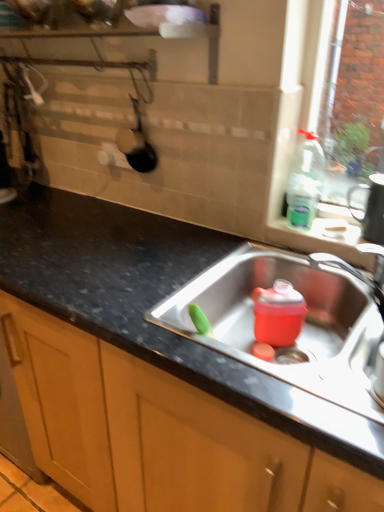
Question: Considering the positions of stainless steel sink at center and black matte mug at upper right in the image, is stainless steel sink at center wider or thinner than black matte mug at upper right?

Choices:
 (A) thin
 (B) wide

Answer: (B)

Question: Is stainless steel sink at center inside or outside of black matte mug at upper right?

Choices:
 (A) inside
 (B) outside

Answer: (B)

Question: Estimate the real-world distances between objects in this image. Which object is farther from the black granite countertop at center?

Choices:
 (A) metallic silver tap at right
 (B) stainless steel sink at center
 (C) black matte mug at upper right

Answer: (C)

Question: Which object is the closest to the stainless steel sink at center?

Choices:
 (A) black matte mug at upper right
 (B) black granite countertop at center
 (C) metallic silver tap at right

Answer: (C)